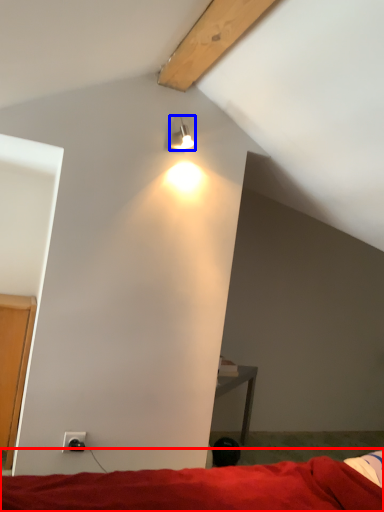
Question: Among these objects, which one is farthest to the camera, bed (highlighted by a red box) or lamp (highlighted by a blue box)?

Choices:
 (A) bed
 (B) lamp

Answer: (B)